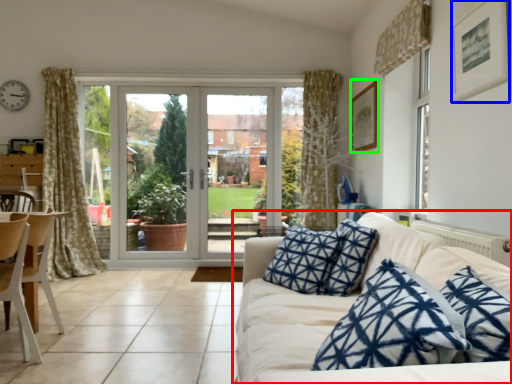
Question: Which object is positioned closest to studio couch (highlighted by a red box)? Select from picture frame (highlighted by a blue box) and picture frame (highlighted by a green box).

Choices:
 (A) picture frame
 (B) picture frame

Answer: (A)